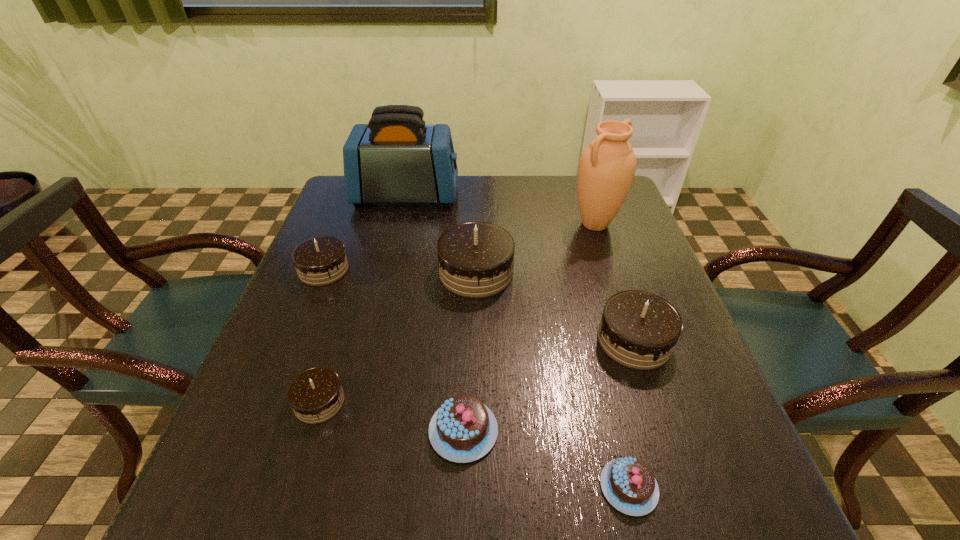
Find the location of a particular element. The height and width of the screenshot is (540, 960). the shortest object is located at coordinates (628, 484).

Identify the location of the smaller pink chocolate cake. Image resolution: width=960 pixels, height=540 pixels. (628, 484).

I want to click on free region located 0.050m on the right of the urn, so click(x=638, y=224).

Where is `free point located on the front-facing side of the blue toaster`? This screenshot has height=540, width=960. free point located on the front-facing side of the blue toaster is located at coordinates (524, 196).

The image size is (960, 540). Identify the location of vacant position located on the front of the second chocolate chocolate cake from right to left. (475, 328).

At what (x,y) coordinates should I click in order to perform the action: click on vacant space located on the left of the second tallest chocolate cake. Please return your answer as a coordinate pair (x, y). The height and width of the screenshot is (540, 960). Looking at the image, I should click on (439, 340).

You are a GUI agent. You are given a task and a screenshot of the screen. Output one action in this format:
    pyautogui.click(x=<x>, y=<y>)
    Task: Click on the free region located on the back of the fourth shortest chocolate cake
    The height and width of the screenshot is (540, 960).
    Given the screenshot: What is the action you would take?
    pyautogui.click(x=338, y=233)

Locate an element on the screen. free space located 0.160m on the front of the smallest chocolate chocolate cake is located at coordinates (282, 523).

Identify the location of free space located 0.080m on the left of the left pink chocolate cake. (383, 431).

Where is `vacant space located 0.340m on the left of the shortest object`? Image resolution: width=960 pixels, height=540 pixels. vacant space located 0.340m on the left of the shortest object is located at coordinates (384, 487).